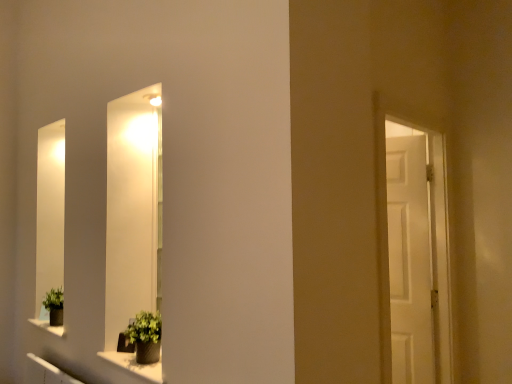
Question: Is green matte plant at lower left, which is counted as the first houseplant, starting from the left, in front of or behind green matte plant pot at lower left, arranged as the 1th houseplant when viewed from the front, in the image?

Choices:
 (A) front
 (B) behind

Answer: (B)

Question: From the image's perspective, is green matte plant at lower left, arranged as the 2th houseplant when viewed from the front, positioned above or below green matte plant pot at lower left, arranged as the 1th houseplant when viewed from the front?

Choices:
 (A) above
 (B) below

Answer: (B)

Question: Based on their relative distances, which object is farther from the matte gray stone window sill at lower center?

Choices:
 (A) green matte plant pot at lower left, which ranks as the 1th houseplant in right-to-left order
 (B) green matte plant at lower left, arranged as the 2th houseplant when viewed from the front
 (C) white wooden door at right

Answer: (C)

Question: Which object is the closest to the white wooden door at right?

Choices:
 (A) green matte plant at lower left, arranged as the 2th houseplant when viewed from the front
 (B) green matte plant pot at lower left, which ranks as the 1th houseplant in right-to-left order
 (C) matte gray stone window sill at lower center

Answer: (B)